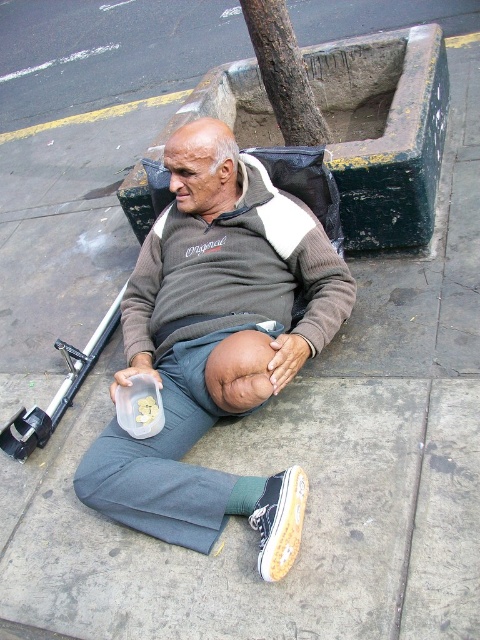
You are a delivery person who needs to place a package on the ground near the gray cotton sweater at center and the white canvas shoe at lower center. Which object should you place the package closer to if you want it to be higher up?

The gray cotton sweater at center is located above the white canvas shoe at lower center, so placing the package closer to the gray cotton sweater at center would result in it being higher up.

You are a city planner analyzing the layout of this urban scene. You need to place a new bench exactly at the coordinates where the gray cotton sweater at center is located. What is the coordinate point where you should place the bench?

The gray cotton sweater at center is located at point (x=216, y=346), so the bench should be placed at coordinates (x=216, y=346).

You are a fashion designer observing an elderly man in an urban setting. You notice the gray cotton sweater at center and the white canvas shoe at lower center. Which item of clothing is bigger in size?

The gray cotton sweater at center is larger in size than the white canvas shoe at lower center.